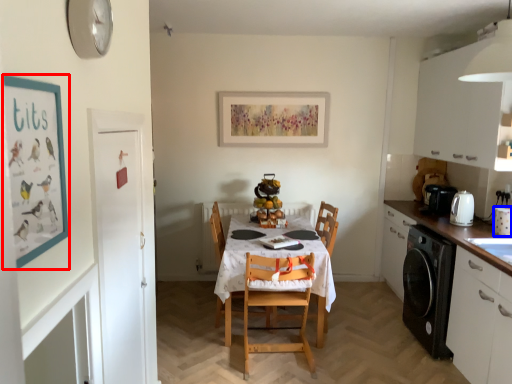
Question: Which object appears farthest to the camera in this image, bulletin board (highlighted by a red box) or appliance (highlighted by a blue box)?

Choices:
 (A) bulletin board
 (B) appliance

Answer: (B)